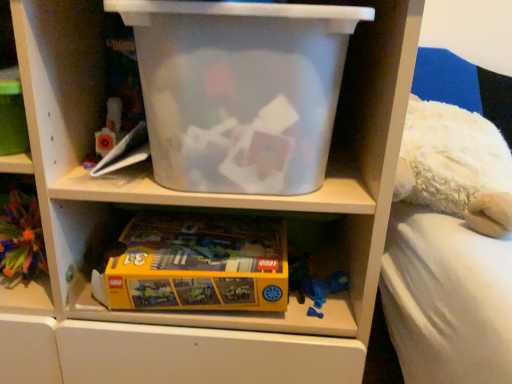
Image resolution: width=512 pixels, height=384 pixels. I want to click on transparent plastic storage box at upper center, so click(x=240, y=91).

In order to face transparent plastic storage box at upper center, should I rotate leftwards or rightwards?

It's best to rotate left around 2.034 degrees.

Image resolution: width=512 pixels, height=384 pixels. Describe the element at coordinates (196, 264) in the screenshot. I see `yellow cardboard lego box at lower center` at that location.

Describe the element at coordinates (22, 249) in the screenshot. I see `yellow matte lego box at lower left` at that location.

Image resolution: width=512 pixels, height=384 pixels. In order to click on transparent plastic storage box at upper center in this screenshot , I will do `click(240, 91)`.

Is yellow cardboard lego box at lower center not inside yellow matte lego box at lower left?

yellow cardboard lego box at lower center is positioned outside yellow matte lego box at lower left.

Based on their positions, is yellow cardboard lego box at lower center located to the left or right of yellow matte lego box at lower left?

yellow cardboard lego box at lower center is to the right of yellow matte lego box at lower left.

Looking at this image, is yellow cardboard lego box at lower center placed right next to yellow matte lego box at lower left?

No, yellow cardboard lego box at lower center is not next to yellow matte lego box at lower left.

From the image's perspective, is yellow cardboard lego box at lower center positioned above or below yellow matte lego box at lower left?

yellow cardboard lego box at lower center is situated lower than yellow matte lego box at lower left in the image.

Is transparent plastic storage box at upper center positioned beyond the bounds of yellow cardboard lego box at lower center?

Absolutely, transparent plastic storage box at upper center is external to yellow cardboard lego box at lower center.

In the image, is transparent plastic storage box at upper center on the left side or the right side of yellow cardboard lego box at lower center?

transparent plastic storage box at upper center is positioned on yellow cardboard lego box at lower center's right side.

Considering the sizes of objects transparent plastic storage box at upper center and yellow cardboard lego box at lower center in the image provided, who is thinner, transparent plastic storage box at upper center or yellow cardboard lego box at lower center?

Thinner between the two is transparent plastic storage box at upper center.

From a real-world perspective, who is located lower, transparent plastic storage box at upper center or yellow cardboard lego box at lower center?

In real-world perspective, yellow cardboard lego box at lower center is lower.

Does point (32, 184) come behind point (204, 239)?

No, it is in front of (204, 239).

This screenshot has width=512, height=384. Identify the location of shelf above the yellow cardboard lego box at lower center (from the image's perspective). (22, 249).

Is yellow matte lego box at lower left not close to yellow cardboard lego box at lower center?

No, there isn't a large distance between yellow matte lego box at lower left and yellow cardboard lego box at lower center.

Can you tell me how much yellow matte lego box at lower left and yellow cardboard lego box at lower center differ in facing direction?

They differ by 1.52 degrees in their facing directions.

Is yellow matte lego box at lower left inside the boundaries of transparent plastic storage box at upper center, or outside?

yellow matte lego box at lower left is outside transparent plastic storage box at upper center.

Identify the location of shelf that is on the left side of transparent plastic storage box at upper center. (22, 249).

Who is shorter, yellow matte lego box at lower left or transparent plastic storage box at upper center?

yellow matte lego box at lower left is shorter.

Is yellow matte lego box at lower left facing away from transparent plastic storage box at upper center?

No, yellow matte lego box at lower left is not facing the opposite direction of transparent plastic storage box at upper center.

Is yellow cardboard lego box at lower center with transparent plastic storage box at upper center?

There is a gap between yellow cardboard lego box at lower center and transparent plastic storage box at upper center.

In the image, is yellow cardboard lego box at lower center on the left side or the right side of transparent plastic storage box at upper center?

In the image, yellow cardboard lego box at lower center appears on the left side of transparent plastic storage box at upper center.

Is point (93, 290) positioned after point (267, 152)?

Yes, it is behind point (267, 152).

Could you tell me if yellow cardboard lego box at lower center is turned towards transparent plastic storage box at upper center?

No, yellow cardboard lego box at lower center is not facing towards transparent plastic storage box at upper center.

In the scene shown: How different are the orientations of transparent plastic storage box at upper center and yellow matte lego box at lower left in degrees?

There is a 0.227-degree angle between the facing directions of transparent plastic storage box at upper center and yellow matte lego box at lower left.

Are transparent plastic storage box at upper center and yellow matte lego box at lower left beside each other?

No, transparent plastic storage box at upper center is not beside yellow matte lego box at lower left.

Find the location of a particular element. The height and width of the screenshot is (384, 512). storage box in front of the yellow matte lego box at lower left is located at coordinates (240, 91).

Where is `toy in front of the yellow matte lego box at lower left`? toy in front of the yellow matte lego box at lower left is located at coordinates (196, 264).

Image resolution: width=512 pixels, height=384 pixels. In order to click on toy below the transparent plastic storage box at upper center (from a real-world perspective) in this screenshot , I will do `click(196, 264)`.

In the scene shown: When comparing their distances from transparent plastic storage box at upper center, does yellow matte lego box at lower left or yellow cardboard lego box at lower center seem further?

yellow matte lego box at lower left lies further to transparent plastic storage box at upper center than the other object.

From the picture: From the image, which object appears to be nearer to yellow cardboard lego box at lower center, yellow matte lego box at lower left or transparent plastic storage box at upper center?

The object closer to yellow cardboard lego box at lower center is transparent plastic storage box at upper center.

Estimate the real-world distances between objects in this image. Which object is closer to transparent plastic storage box at upper center, yellow cardboard lego box at lower center or yellow matte lego box at lower left?

yellow cardboard lego box at lower center is closer to transparent plastic storage box at upper center.

Based on the photo, estimate the real-world distances between objects in this image. Which object is closer to yellow matte lego box at lower left, transparent plastic storage box at upper center or yellow cardboard lego box at lower center?

A: Based on the image, yellow cardboard lego box at lower center appears to be nearer to yellow matte lego box at lower left.

Based on their spatial positions, is transparent plastic storage box at upper center or yellow matte lego box at lower left closer to yellow cardboard lego box at lower center?

transparent plastic storage box at upper center.

Looking at the image, which one is located further to yellow matte lego box at lower left, yellow cardboard lego box at lower center or transparent plastic storage box at upper center?

transparent plastic storage box at upper center.

At what (x,y) coordinates should I click in order to perform the action: click on toy between yellow matte lego box at lower left and transparent plastic storage box at upper center from left to right. Please return your answer as a coordinate pair (x, y). Looking at the image, I should click on (196, 264).